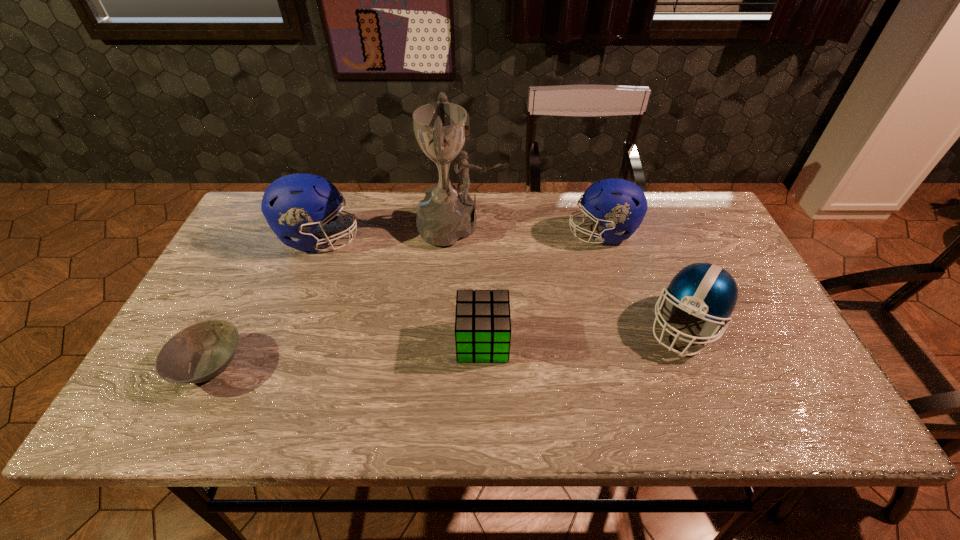
Select which football helmet appears as the closest to the bowl. Please provide its 2D coordinates. Your answer should be formatted as a tuple, i.e. [(x, y)], where the tuple contains the x and y coordinates of a point satisfying the conditions above.

[(294, 205)]

Point out which football helmet is positioned as the second nearest to the leftmost football helmet. Please provide its 2D coordinates. Your answer should be formatted as a tuple, i.e. [(x, y)], where the tuple contains the x and y coordinates of a point satisfying the conditions above.

[(705, 290)]

This screenshot has height=540, width=960. What are the coordinates of `free region that satisfies the following two spatial constraints: 1. on the side with emblem of the award; 2. on the left side of the second shortest object` in the screenshot? It's located at (453, 342).

Image resolution: width=960 pixels, height=540 pixels. What are the coordinates of `blank area in the image that satisfies the following two spatial constraints: 1. on the front-facing side of the leftmost football helmet; 2. on the right side of the second shortest object` in the screenshot? It's located at (279, 342).